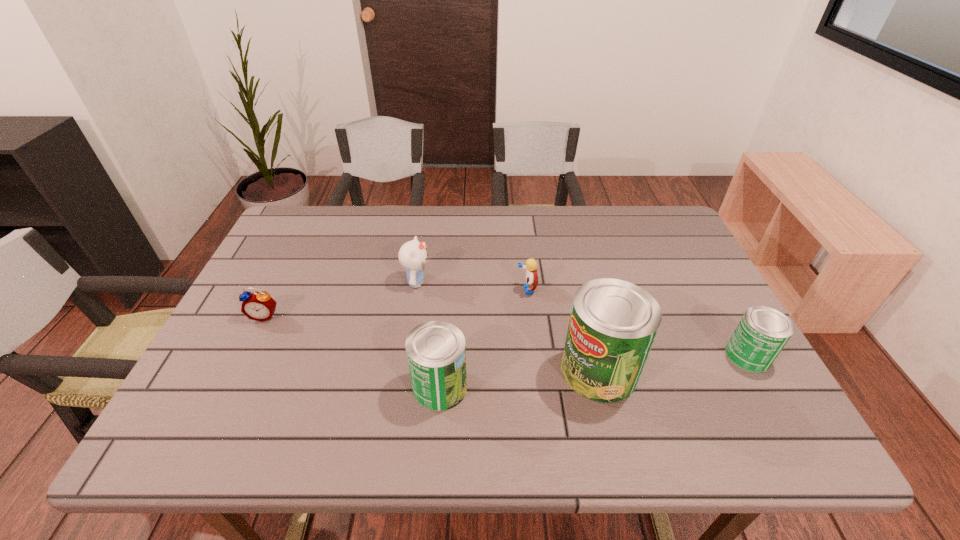
Please point a spot to add another can on the left. Please provide its 2D coordinates. Your answer should be formatted as a tuple, i.e. [(x, y)], where the tuple contains the x and y coordinates of a point satisfying the conditions above.

[(271, 404)]